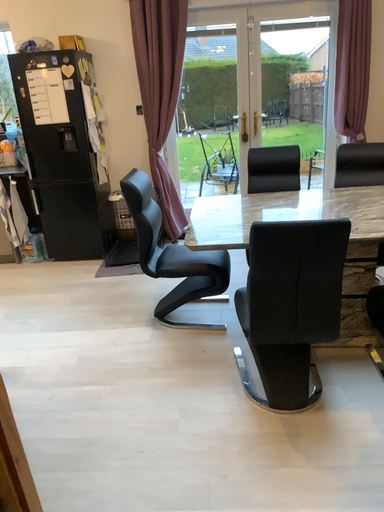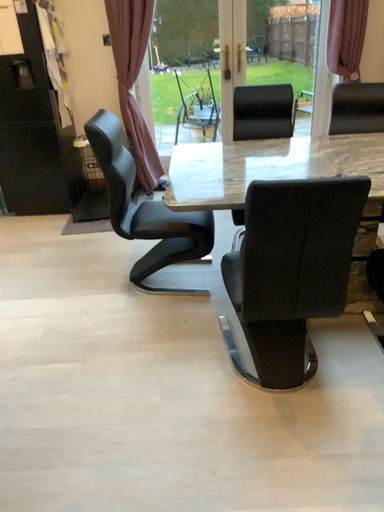
Question: Which way did the camera rotate in the video?

Choices:
 (A) rotated upward
 (B) rotated downward

Answer: (B)